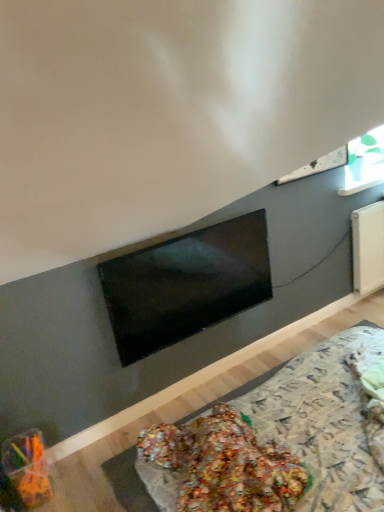
Question: Does translucent plastic container at lower left have a larger size compared to matte black tv at center?

Choices:
 (A) no
 (B) yes

Answer: (A)

Question: From a real-world perspective, is translucent plastic container at lower left beneath matte black tv at center?

Choices:
 (A) no
 (B) yes

Answer: (B)

Question: Considering the relative positions of translucent plastic container at lower left and matte black tv at center in the image provided, is translucent plastic container at lower left behind matte black tv at center?

Choices:
 (A) yes
 (B) no

Answer: (B)

Question: Does translucent plastic container at lower left have a lesser height compared to matte black tv at center?

Choices:
 (A) yes
 (B) no

Answer: (A)

Question: Is translucent plastic container at lower left facing towards matte black tv at center?

Choices:
 (A) no
 (B) yes

Answer: (A)

Question: Is translucent plastic container at lower left positioned before matte black tv at center?

Choices:
 (A) yes
 (B) no

Answer: (A)

Question: Can you confirm if transparent glass window at upper right is thinner than translucent plastic container at lower left?

Choices:
 (A) no
 (B) yes

Answer: (B)

Question: Considering the relative sizes of transparent glass window at upper right and translucent plastic container at lower left in the image provided, is transparent glass window at upper right wider than translucent plastic container at lower left?

Choices:
 (A) yes
 (B) no

Answer: (B)

Question: Can you confirm if transparent glass window at upper right is bigger than translucent plastic container at lower left?

Choices:
 (A) no
 (B) yes

Answer: (B)

Question: Is transparent glass window at upper right smaller than translucent plastic container at lower left?

Choices:
 (A) yes
 (B) no

Answer: (B)

Question: Is transparent glass window at upper right not close to translucent plastic container at lower left?

Choices:
 (A) yes
 (B) no

Answer: (A)

Question: Does transparent glass window at upper right appear on the right side of translucent plastic container at lower left?

Choices:
 (A) yes
 (B) no

Answer: (A)

Question: From the image's perspective, is translucent plastic container at lower left under transparent glass window at upper right?

Choices:
 (A) no
 (B) yes

Answer: (B)